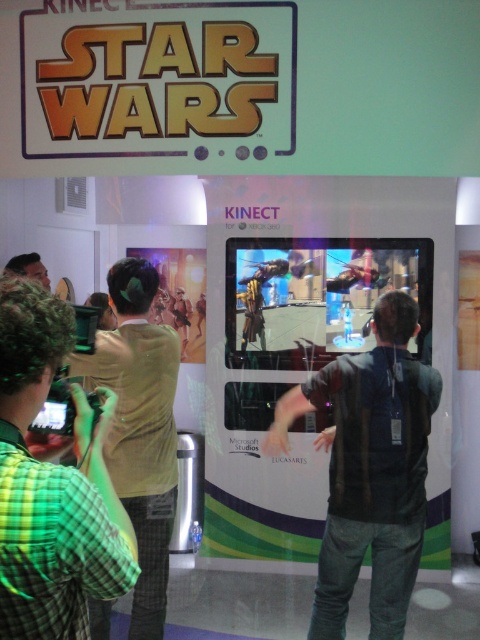
Who is lower down, green plaid shirt at left or dark gray vest at center?

dark gray vest at center is lower down.

Between point (66, 605) and point (333, 560), which one is positioned in front?

Positioned in front is point (66, 605).

What do you see at coordinates (51, 484) in the screenshot? The image size is (480, 640). I see `green plaid shirt at left` at bounding box center [51, 484].

In order to click on green plaid shirt at left in this screenshot , I will do 51,484.

Does dark gray vest at center have a smaller size compared to light brown shirt at center?

Incorrect, dark gray vest at center is not smaller in size than light brown shirt at center.

Who is more distant from viewer, [405,342] or [133,449]?

The point [405,342] is more distant.

Is point (417, 557) positioned after point (151, 552)?

No, it is not.

Image resolution: width=480 pixels, height=640 pixels. I want to click on dark gray vest at center, so click(x=370, y=468).

Between green plaid shirt at left and light brown shirt at center, which one appears on the left side from the viewer's perspective?

Positioned to the left is light brown shirt at center.

Who is taller, green plaid shirt at left or light brown shirt at center?

With more height is light brown shirt at center.

Is point (19, 580) more distant than point (117, 378)?

No.

Where is `green plaid shirt at left`? The height and width of the screenshot is (640, 480). green plaid shirt at left is located at coordinates (51, 484).